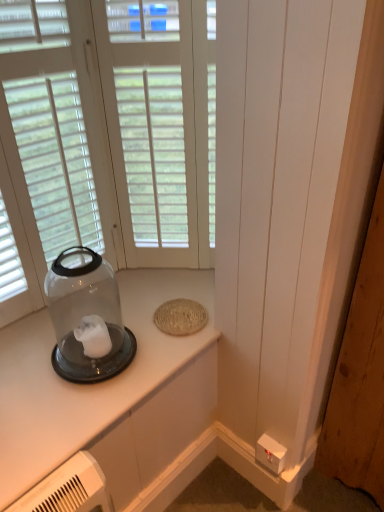
The image size is (384, 512). In order to click on vacant space to the right of transparent glass jar at left in this screenshot , I will do `click(156, 355)`.